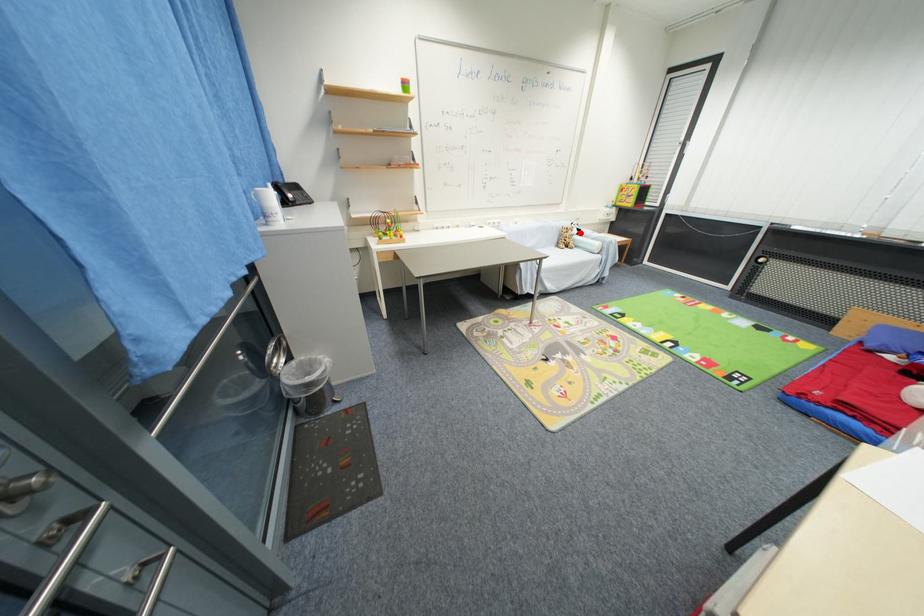
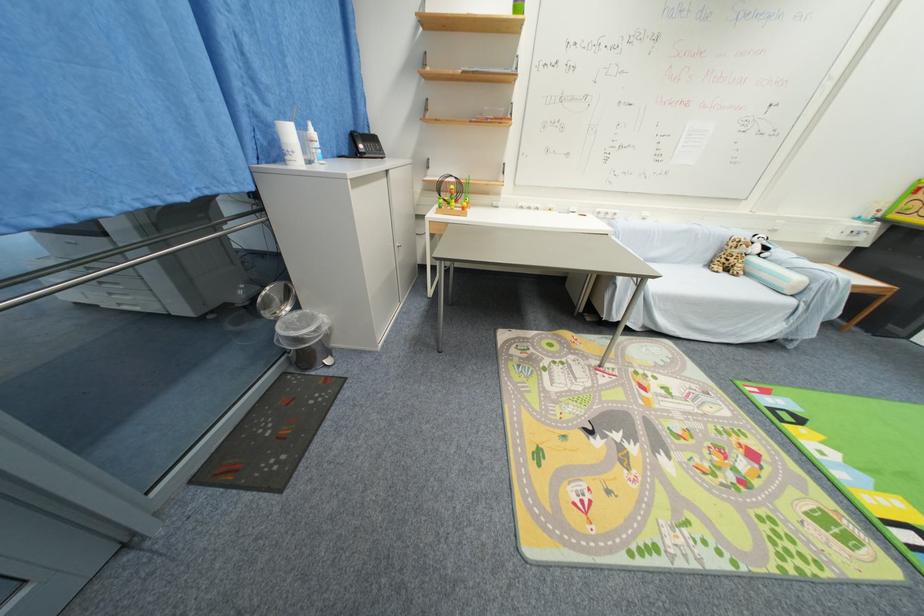
Question: I am providing you with two images of the same scene from different viewpoints. A red point is shown in image1. For the corresponding object point in image2, is it positioned nearer or farther from the camera?

Choices:
 (A) Nearer
 (B) Farther

Answer: (B)